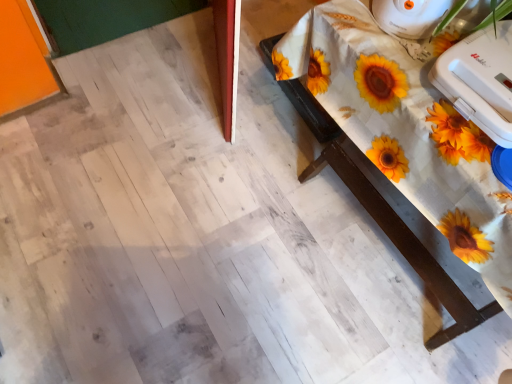
Question: Considering the positions of white plastic iron at upper right, positioned as the second appliance in bottom-to-top order, and white wood table at upper right in the image, is white plastic iron at upper right, positioned as the second appliance in bottom-to-top order, wider or thinner than white wood table at upper right?

Choices:
 (A) thin
 (B) wide

Answer: (A)

Question: Is white plastic iron at upper right, positioned as the second appliance in bottom-to-top order, to the left or to the right of white wood table at upper right in the image?

Choices:
 (A) right
 (B) left

Answer: (B)

Question: Which object is the closest to the white plastic toaster at upper right, which is the second appliance from top to bottom?

Choices:
 (A) white wood table at upper right
 (B) white plastic iron at upper right, positioned as the second appliance in bottom-to-top order

Answer: (B)

Question: Which of these objects is positioned closest to the white plastic toaster at upper right, arranged as the 1th appliance when ordered from the bottom?

Choices:
 (A) white plastic iron at upper right, positioned as the second appliance in bottom-to-top order
 (B) white wood table at upper right

Answer: (A)